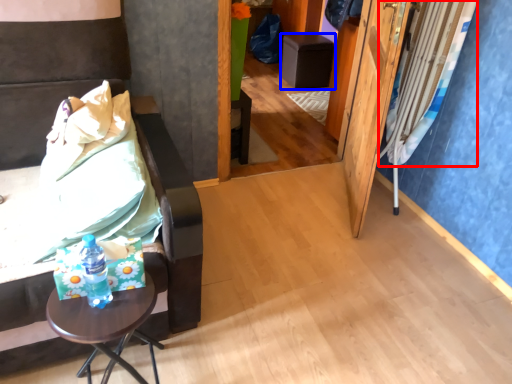
Question: Which object is closer to the camera taking this photo, curtain (highlighted by a red box) or furniture (highlighted by a blue box)?

Choices:
 (A) curtain
 (B) furniture

Answer: (A)